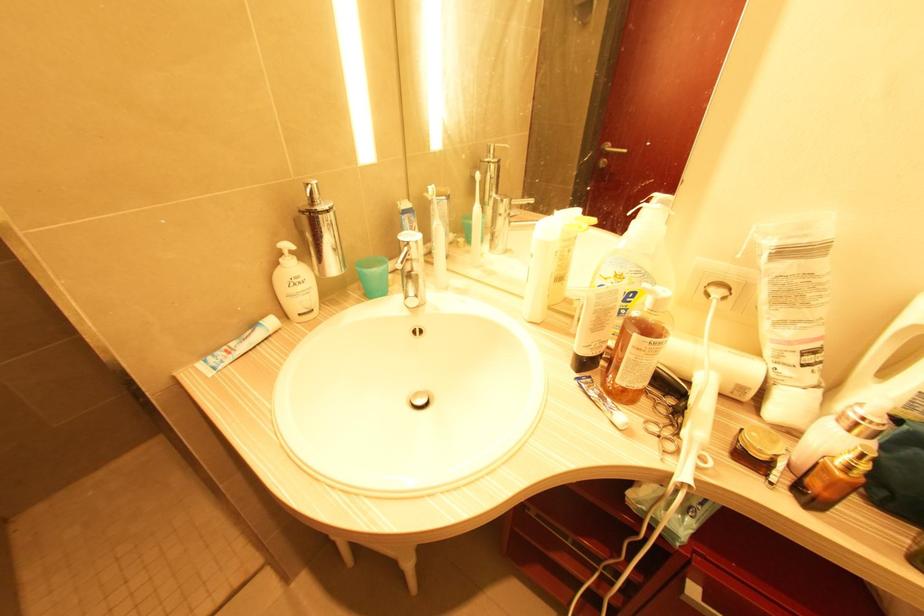
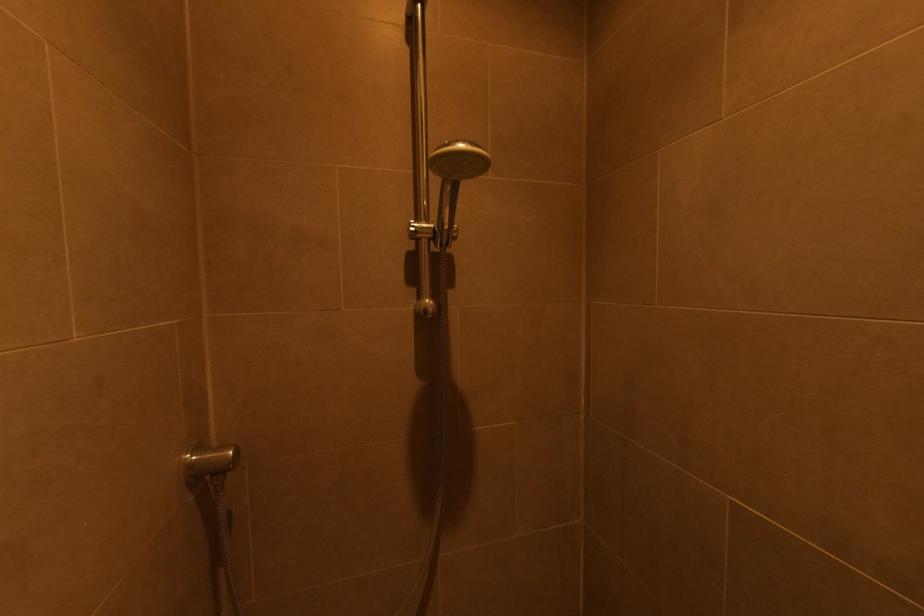
Question: I am providing you with two images of the same scene from different viewpoints. Please identify which objects are invisible in image2.

Choices:
 (A) faucet handle
 (B) yellow plate
 (C) shower holder adjuster
 (D) handheld shower head

Answer: (A)